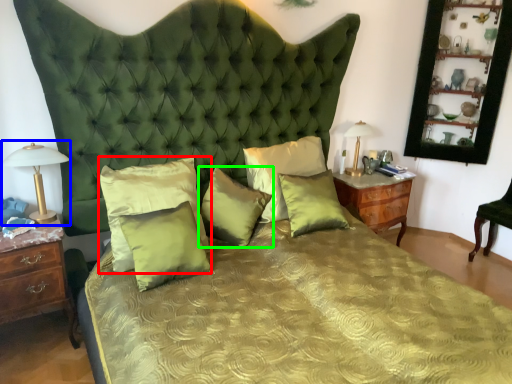
Question: Considering the real-world distances, which object is closest to pillow (highlighted by a red box)? bedside lamp (highlighted by a blue box) or pillow (highlighted by a green box).

Choices:
 (A) bedside lamp
 (B) pillow

Answer: (B)